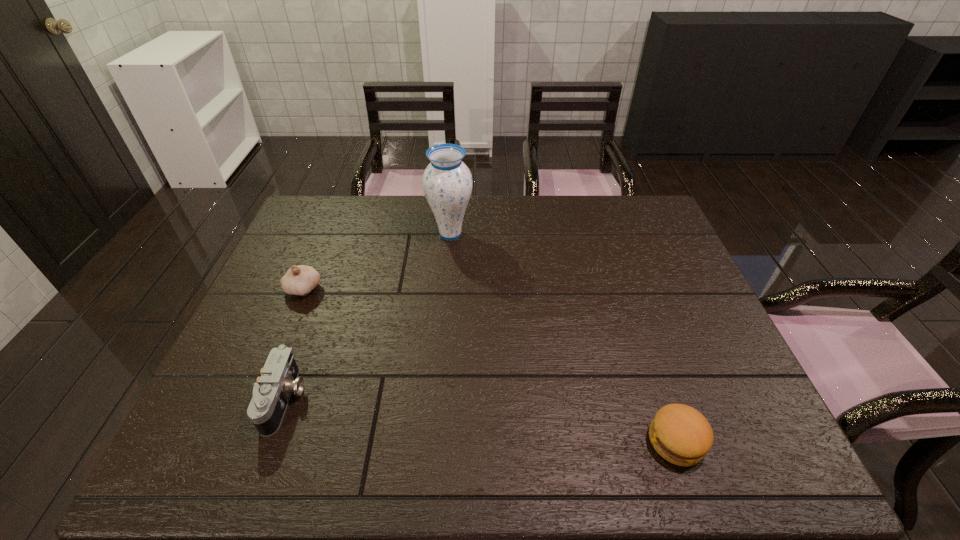
Identify the location of free spot between the second farthest object and the second object from right to left. This screenshot has height=540, width=960. (376, 262).

Find the location of a particular element. The height and width of the screenshot is (540, 960). free space that is in between the rightmost object and the camera is located at coordinates (480, 420).

Choose which object is the second nearest neighbor to the camera. Please provide its 2D coordinates. Your answer should be formatted as a tuple, i.e. [(x, y)], where the tuple contains the x and y coordinates of a point satisfying the conditions above.

[(447, 182)]

Identify which object is the closest to the garlic. Please provide its 2D coordinates. Your answer should be formatted as a tuple, i.e. [(x, y)], where the tuple contains the x and y coordinates of a point satisfying the conditions above.

[(279, 378)]

Where is `free space that satisfies the following two spatial constraints: 1. on the front side of the second farthest object; 2. on the right side of the rightmost object`? free space that satisfies the following two spatial constraints: 1. on the front side of the second farthest object; 2. on the right side of the rightmost object is located at coordinates (239, 441).

Identify the location of vacant area in the image that satisfies the following two spatial constraints: 1. on the lens of the hamburger; 2. on the right side of the camera. This screenshot has width=960, height=540. (270, 441).